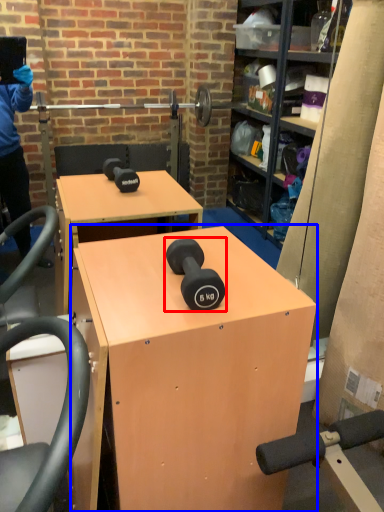
Question: Which point is further to the camera, dumbbell (highlighted by a red box) or desk (highlighted by a blue box)?

Choices:
 (A) dumbbell
 (B) desk

Answer: (A)